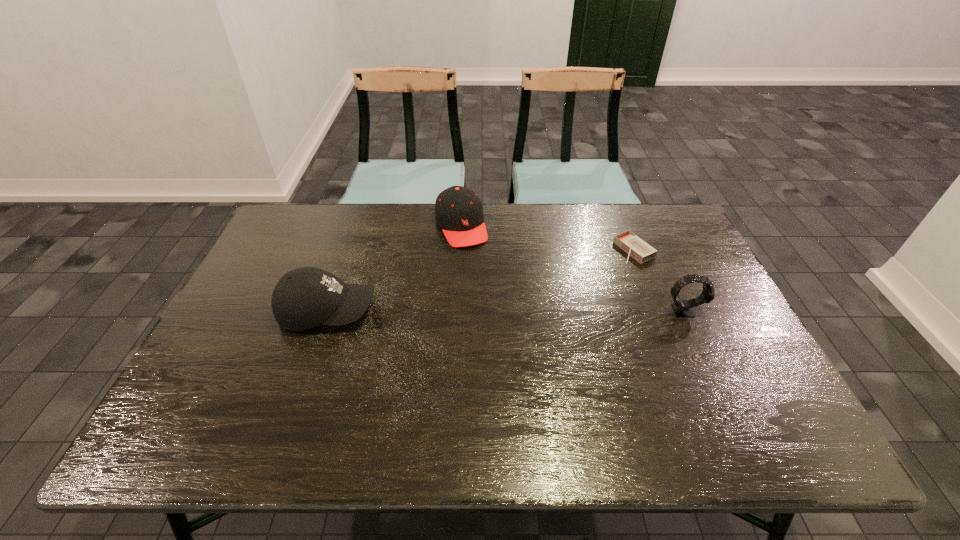
At what (x,y) coordinates should I click in order to perform the action: click on free space on the desktop that is between the baseball cap and the watch and is positioned on the front-facing side of the third object from right to left. Please return your answer as a coordinate pair (x, y). This screenshot has width=960, height=540. Looking at the image, I should click on (499, 310).

Where is `free space on the desktop that is between the leftmost object and the watch and is positioned on the striking surface of the matchbox`? The image size is (960, 540). free space on the desktop that is between the leftmost object and the watch and is positioned on the striking surface of the matchbox is located at coordinates (496, 310).